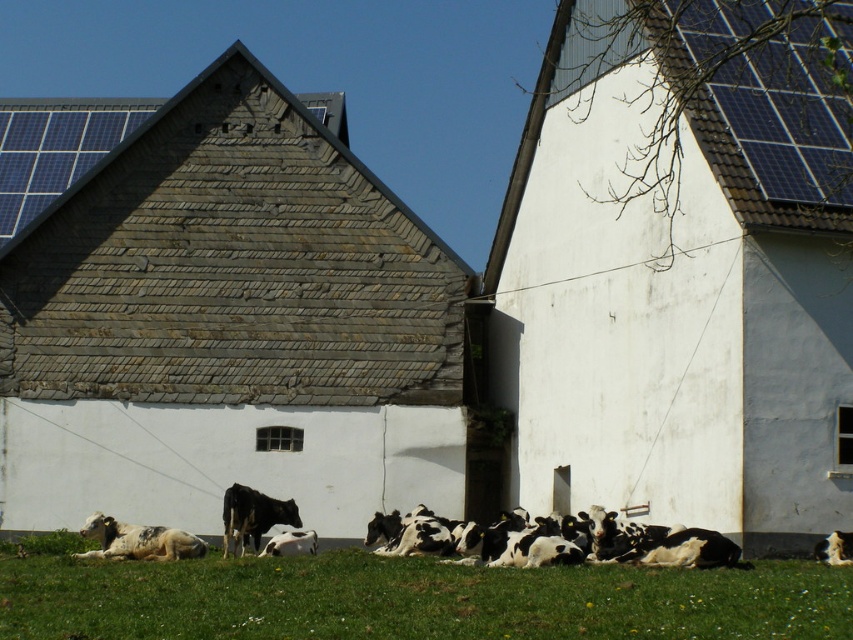
Question: Is rustic stone barn at center smaller than black-and-white spotted cows at center?

Choices:
 (A) yes
 (B) no

Answer: (B)

Question: Among these objects, which one is farthest from the camera?

Choices:
 (A) green grass at lower center
 (B) white matte barn at lower right

Answer: (B)

Question: Among these points, which one is nearest to the camera?

Choices:
 (A) (297, 376)
 (B) (851, 586)
 (C) (549, 182)
 (D) (399, 531)

Answer: (B)

Question: Among these points, which one is farthest from the camera?

Choices:
 (A) (675, 548)
 (B) (496, 246)
 (C) (288, 429)
 (D) (715, 602)

Answer: (B)

Question: Is rustic stone barn at center bigger than green grass at lower center?

Choices:
 (A) no
 (B) yes

Answer: (A)

Question: Is rustic stone barn at center above white matte barn at lower right?

Choices:
 (A) no
 (B) yes

Answer: (A)